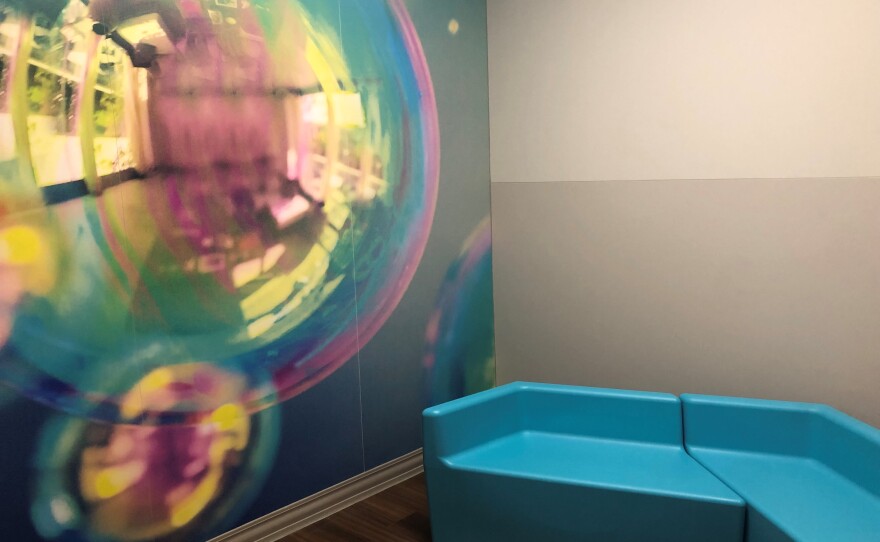
You are a GUI agent. You are given a task and a screenshot of the screen. Output one action in this format:
    pyautogui.click(x=<x>, y=<y>)
    Task: Click on the back wall
    This screenshot has width=880, height=542.
    Given the screenshot: What is the action you would take?
    pyautogui.click(x=684, y=187)